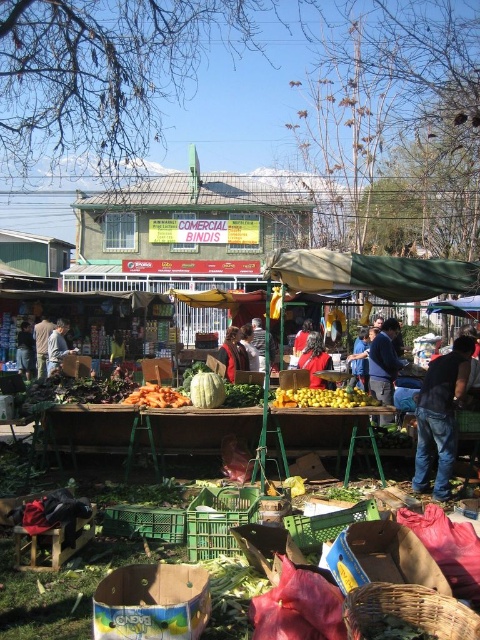
Question: Does jeans at lower right appear under orange matte carrots at center?

Choices:
 (A) yes
 (B) no

Answer: (A)

Question: Which object is positioned closest to the green leafy vegetables at center?

Choices:
 (A) orange matte carrots at center
 (B) dark blue jeans at center
 (C) red fabric jacket at center

Answer: (A)

Question: Does blue denim jacket at center have a larger size compared to orange matte carrots at center?

Choices:
 (A) no
 (B) yes

Answer: (B)

Question: Estimate the real-world distances between objects in this image. Which object is farther from the orange matte carrots at center?

Choices:
 (A) green plastic crates at center
 (B) brown leather jacket at center
 (C) matte red jacket at center

Answer: (B)

Question: Is jeans at lower right wider than matte red jacket at center?

Choices:
 (A) yes
 (B) no

Answer: (A)

Question: Among these points, which one is farthest from the camera?

Choices:
 (A) (324, 388)
 (B) (305, 413)
 (C) (312, 378)
 (D) (235, 390)

Answer: (C)